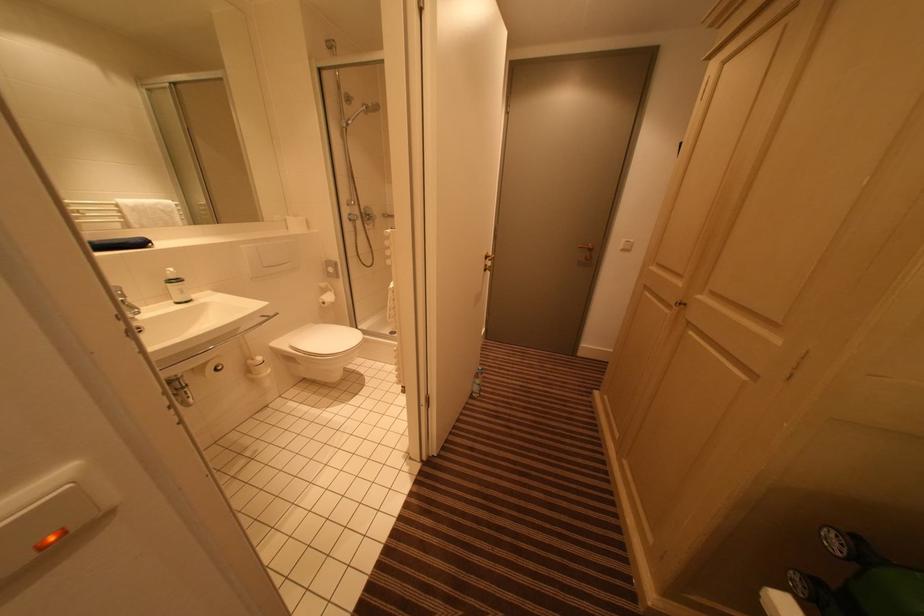
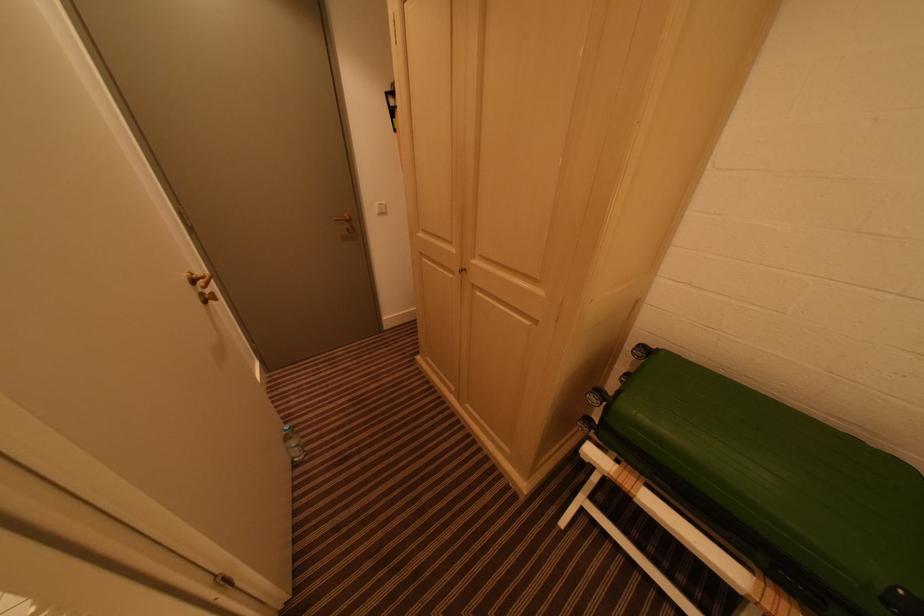
Where in the second image is the point corresponding to pixel 482 378 from the first image?

(293, 440)